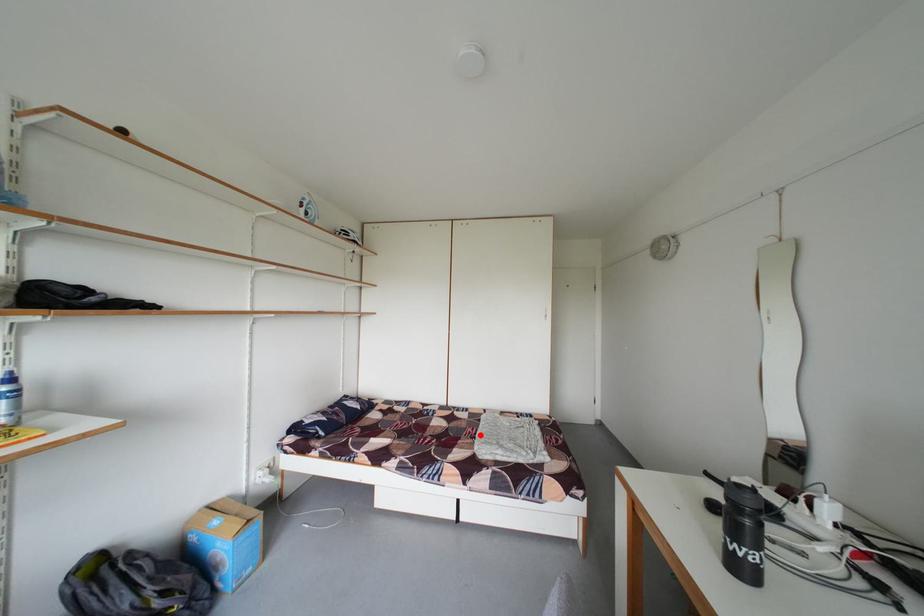
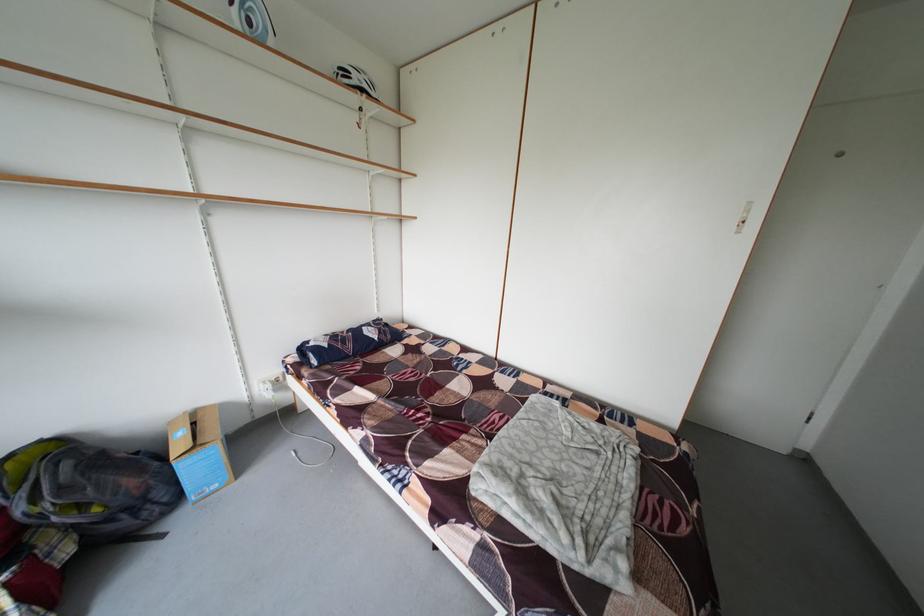
Find the pixel in the second image that matches the highlighted location in the first image.

(506, 422)